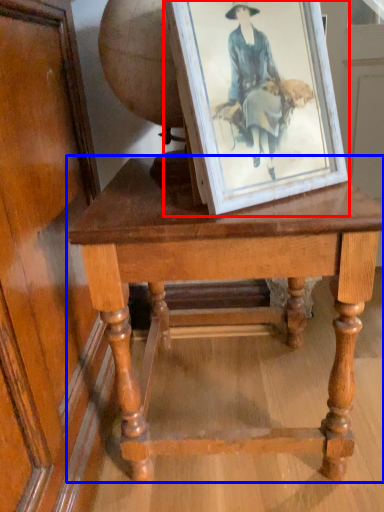
Question: Which point is further to the camera, picture frame (highlighted by a red box) or table (highlighted by a blue box)?

Choices:
 (A) picture frame
 (B) table

Answer: (B)